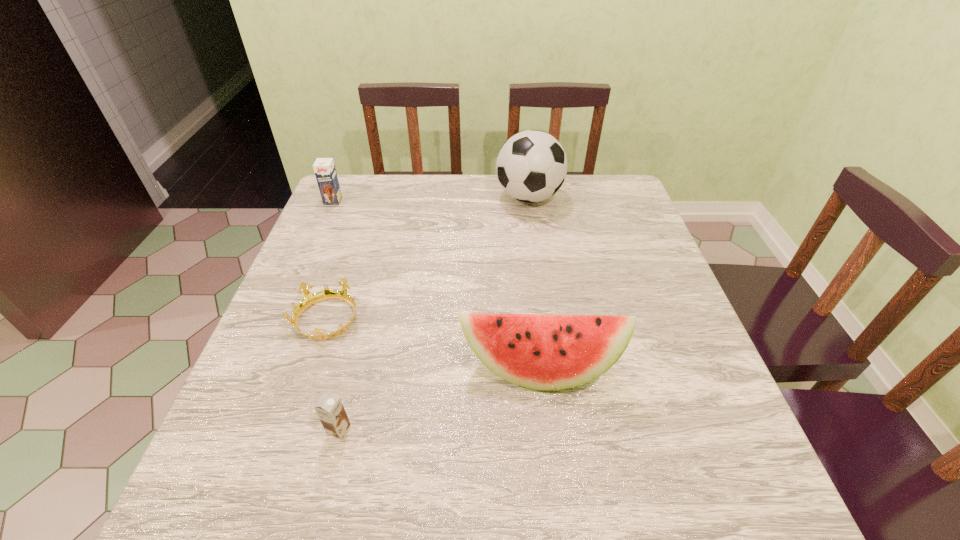
Locate an element on the screen. The width and height of the screenshot is (960, 540). vacant space located on the back of the nearer chocolate milk is located at coordinates (356, 360).

Identify the location of free space located on the front of the crown. The height and width of the screenshot is (540, 960). (293, 423).

The width and height of the screenshot is (960, 540). Identify the location of soccer ball that is at the far edge. (531, 166).

This screenshot has width=960, height=540. I want to click on chocolate milk present at the far edge, so click(324, 168).

Locate an element on the screen. This screenshot has height=540, width=960. chocolate milk located in the left edge section of the desktop is located at coordinates (324, 168).

Where is `crown at the left edge`? Image resolution: width=960 pixels, height=540 pixels. crown at the left edge is located at coordinates (310, 299).

Where is `object located in the far left corner section of the desktop`? object located in the far left corner section of the desktop is located at coordinates (324, 168).

Locate an element on the screen. The image size is (960, 540). free space at the far edge is located at coordinates (520, 203).

You are a GUI agent. You are given a task and a screenshot of the screen. Output one action in this format:
    pyautogui.click(x=<x>, y=<y>)
    Task: Click on the free space at the near edge of the desktop
    The width and height of the screenshot is (960, 540).
    Given the screenshot: What is the action you would take?
    tap(414, 468)

The image size is (960, 540). I want to click on vacant space at the left edge of the desktop, so click(x=321, y=248).